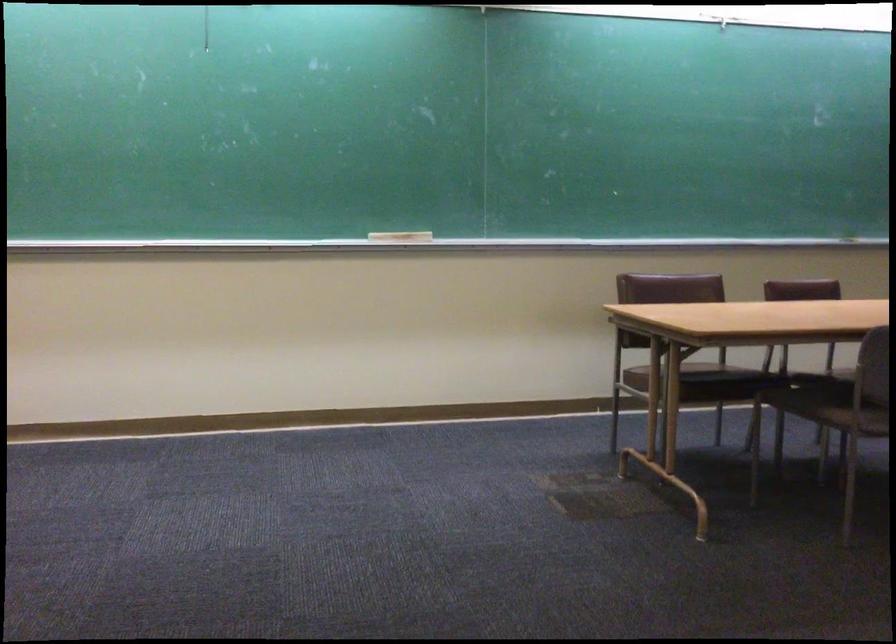
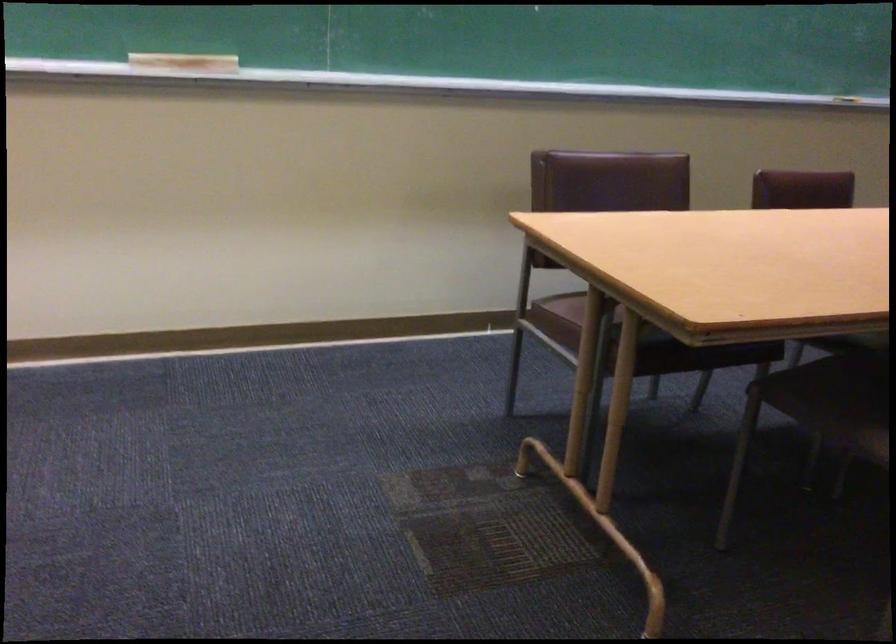
The point at (399, 234) is marked in the first image. Where is the corresponding point in the second image?

(183, 64)